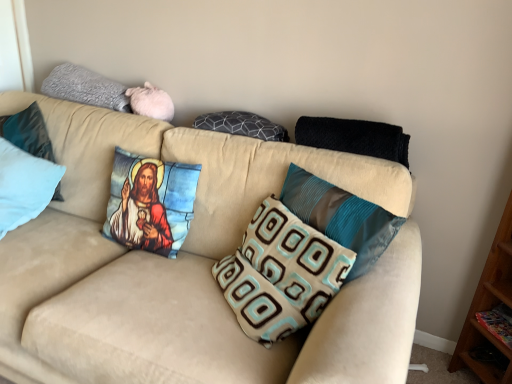
Question: Is black knitted blanket at upper right, arranged as the 8th pillow when viewed from the left, bigger or smaller than light blue fabric pillow at left, which is the 2th pillow from left to right?

Choices:
 (A) big
 (B) small

Answer: (B)

Question: From their relative heights in the image, would you say black knitted blanket at upper right, arranged as the 8th pillow when viewed from the left, is taller or shorter than light blue fabric pillow at left, which is the 2th pillow from left to right?

Choices:
 (A) short
 (B) tall

Answer: (A)

Question: Estimate the real-world distances between objects in this image. Which object is closer to the light blue fabric pillow at left, the first pillow from the left?

Choices:
 (A) black knitted blanket at upper right, arranged as the 1th pillow when viewed from the right
 (B) teal fabric pillow at center, the seventh pillow in the left-to-right sequence
 (C) printed fabric pillow with jesus image at center, the 4th pillow viewed from the left
 (D) brown and teal patterned pillow at center, the 3th pillow in the right-to-left sequence
 (E) beige fabric couch at center

Answer: (C)

Question: Based on their relative distances, which object is farther from the brown and teal patterned pillow at center, positioned as the sixth pillow in left-to-right order?

Choices:
 (A) gray fuzzy pillow at upper left, marked as the 3th pillow in a left-to-right arrangement
 (B) teal fabric pillow at center, which is the second pillow in right-to-left order
 (C) light blue fabric pillow at left, which is the 2th pillow from left to right
 (D) printed fabric pillow with jesus image at center, the 4th pillow viewed from the left
 (E) black knitted blanket at upper right, arranged as the 8th pillow when viewed from the left

Answer: (C)